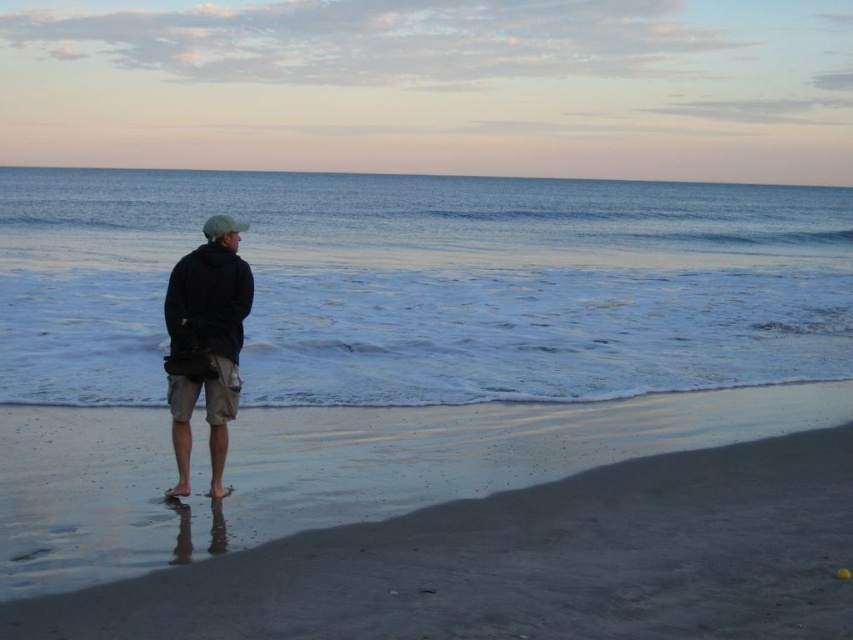
Question: Is blue smooth water at center above dark blue fabric jacket at center?

Choices:
 (A) no
 (B) yes

Answer: (B)

Question: Does dark sand at lower left have a lesser width compared to dark blue fabric jacket at center?

Choices:
 (A) no
 (B) yes

Answer: (A)

Question: Estimate the real-world distances between objects in this image. Which object is closer to the dark blue fabric jacket at center?

Choices:
 (A) blue smooth water at center
 (B) dark sand at lower left

Answer: (B)

Question: Can you confirm if dark sand at lower left is bigger than dark blue fabric jacket at center?

Choices:
 (A) yes
 (B) no

Answer: (B)

Question: Which object appears closest to the camera in this image?

Choices:
 (A) blue smooth water at center
 (B) dark blue fabric jacket at center

Answer: (B)

Question: Among these points, which one is farthest from the camera?

Choices:
 (A) (15, 420)
 (B) (248, 256)

Answer: (B)